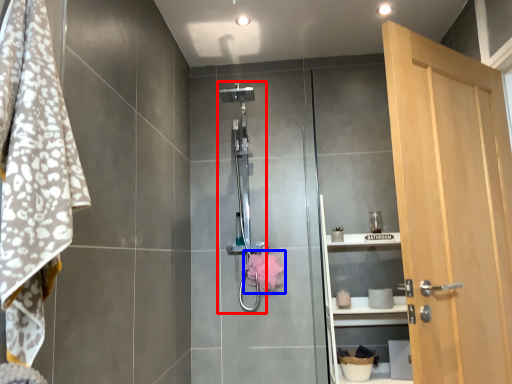
Question: Which object appears farthest to the camera in this image, shower (highlighted by a red box) or hand towel (highlighted by a blue box)?

Choices:
 (A) shower
 (B) hand towel

Answer: (B)